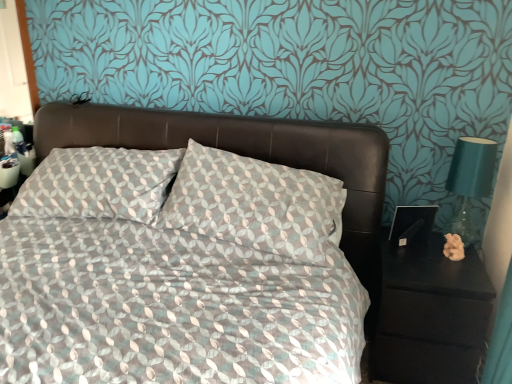
Question: Is patterned fabric bed at center not inside black matte nightstand at right?

Choices:
 (A) no
 (B) yes

Answer: (B)

Question: Is patterned fabric bed at center oriented towards black matte nightstand at right?

Choices:
 (A) no
 (B) yes

Answer: (A)

Question: From the image's perspective, is patterned fabric bed at center located above black matte nightstand at right?

Choices:
 (A) yes
 (B) no

Answer: (A)

Question: From the image's perspective, is patterned fabric bed at center under black matte nightstand at right?

Choices:
 (A) yes
 (B) no

Answer: (B)

Question: From a real-world perspective, is patterned fabric bed at center under black matte nightstand at right?

Choices:
 (A) yes
 (B) no

Answer: (B)

Question: Visually, is patterned fabric bed at center positioned to the left or to the right of teal glass lamp at right?

Choices:
 (A) left
 (B) right

Answer: (A)

Question: Considering the positions of patterned fabric bed at center and teal glass lamp at right in the image, is patterned fabric bed at center bigger or smaller than teal glass lamp at right?

Choices:
 (A) big
 (B) small

Answer: (A)

Question: Is patterned fabric bed at center wider or thinner than teal glass lamp at right?

Choices:
 (A) thin
 (B) wide

Answer: (B)

Question: From the image's perspective, is patterned fabric bed at center located above or below teal glass lamp at right?

Choices:
 (A) above
 (B) below

Answer: (B)

Question: Is point (96, 241) closer or farther from the camera than point (397, 279)?

Choices:
 (A) closer
 (B) farther

Answer: (B)

Question: Considering the positions of patterned fabric bed at center and black matte nightstand at right in the image, is patterned fabric bed at center taller or shorter than black matte nightstand at right?

Choices:
 (A) short
 (B) tall

Answer: (B)

Question: Relative to black matte nightstand at right, is patterned fabric bed at center in front or behind?

Choices:
 (A) front
 (B) behind

Answer: (A)

Question: Based on their sizes in the image, would you say patterned fabric bed at center is bigger or smaller than black matte nightstand at right?

Choices:
 (A) big
 (B) small

Answer: (A)

Question: Visually, is teal glass lamp at right positioned to the left or to the right of black matte nightstand at right?

Choices:
 (A) right
 (B) left

Answer: (A)

Question: From a real-world perspective, is teal glass lamp at right physically located above or below black matte nightstand at right?

Choices:
 (A) below
 (B) above

Answer: (B)